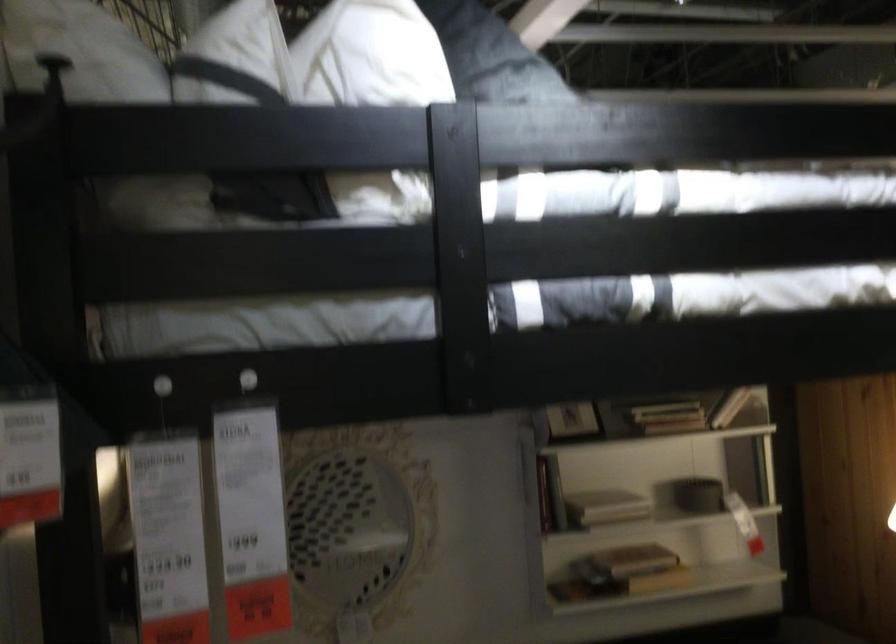
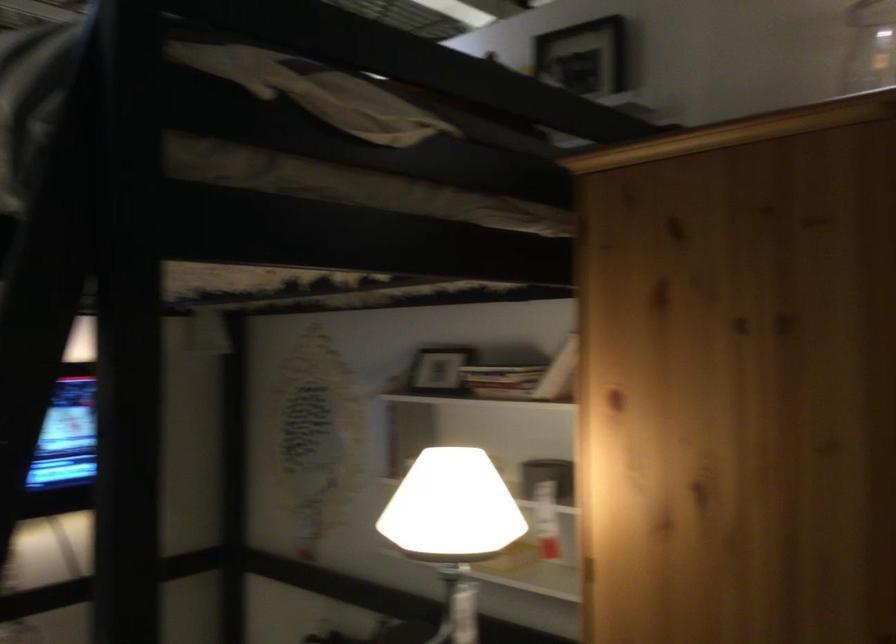
Where in the second image is the point corresponding to point (705, 410) from the first image?

(501, 379)